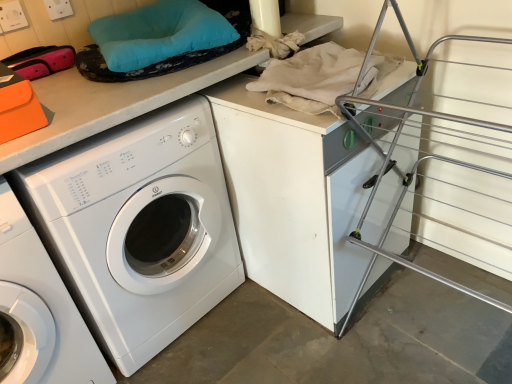
Question: From the image's perspective, is white glossy washing machine at center, the 1th washing machine in the left-to-right sequence, above or below white glossy washing machine at center, positioned as the 1th washing machine in right-to-left order?

Choices:
 (A) below
 (B) above

Answer: (A)

Question: Is white glossy washing machine at center, the 1th washing machine in the left-to-right sequence, to the left or to the right of white glossy washing machine at center, placed as the second washing machine when sorted from left to right, in the image?

Choices:
 (A) right
 (B) left

Answer: (B)

Question: From a real-world perspective, is white glossy washing machine at center, acting as the second washing machine starting from the right, above or below white glossy washing machine at center, placed as the second washing machine when sorted from left to right?

Choices:
 (A) above
 (B) below

Answer: (B)

Question: Is point (210, 178) closer or farther from the camera than point (37, 311)?

Choices:
 (A) closer
 (B) farther

Answer: (B)

Question: In terms of height, does white glossy washing machine at center, placed as the second washing machine when sorted from left to right, look taller or shorter compared to white glossy washing machine at center, acting as the second washing machine starting from the right?

Choices:
 (A) tall
 (B) short

Answer: (A)

Question: From a real-world perspective, is white glossy washing machine at center, positioned as the 1th washing machine in right-to-left order, physically located above or below white glossy washing machine at center, the 1th washing machine in the left-to-right sequence?

Choices:
 (A) below
 (B) above

Answer: (B)

Question: From the image's perspective, is white glossy washing machine at center, positioned as the 1th washing machine in right-to-left order, located above or below white glossy washing machine at center, acting as the second washing machine starting from the right?

Choices:
 (A) below
 (B) above

Answer: (B)